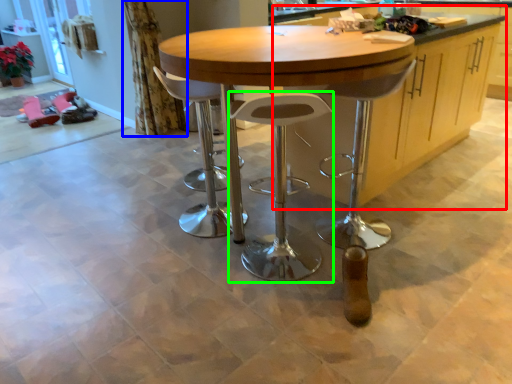
Question: Which object is positioned closest to cabinetry (highlighted by a red box)? Select from curtain (highlighted by a blue box) and stool (highlighted by a green box).

Choices:
 (A) curtain
 (B) stool

Answer: (B)